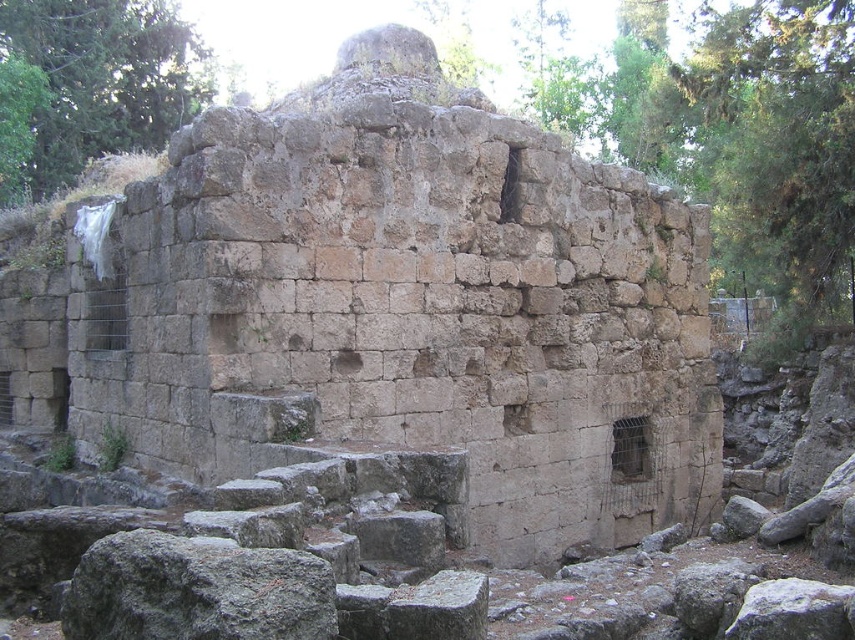
Can you confirm if rustic stone ruins at center is positioned below gray rough rock at lower left?

Incorrect, rustic stone ruins at center is not positioned below gray rough rock at lower left.

Is point (166, 381) farther from viewer compared to point (115, 579)?

Yes, point (166, 381) is behind point (115, 579).

Which is in front, point (230, 401) or point (186, 630)?

Point (186, 630)

This screenshot has height=640, width=855. I want to click on rustic stone ruins at center, so click(x=385, y=305).